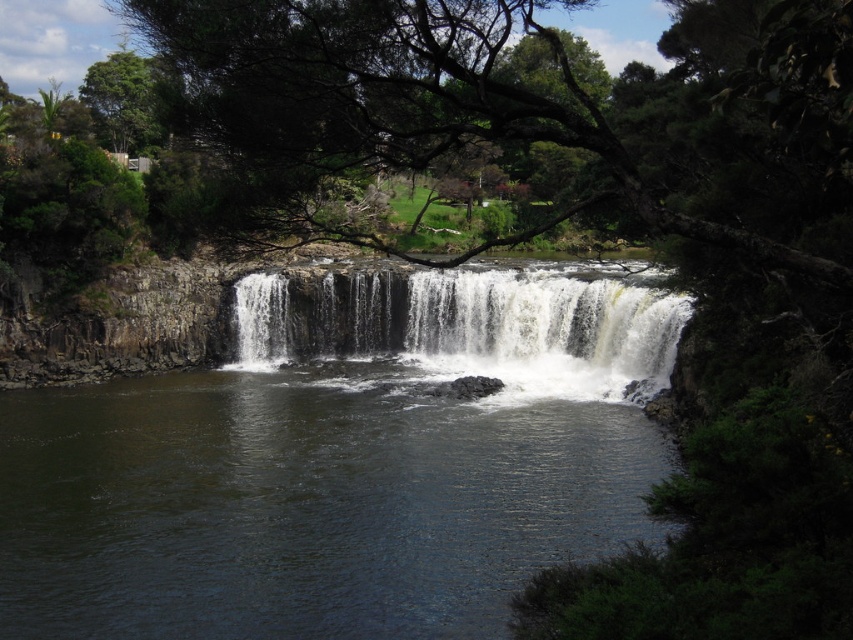
Question: Does dark green water at center have a greater width compared to white textured water at center?

Choices:
 (A) no
 (B) yes

Answer: (B)

Question: Is dark green water at center behind white textured water at center?

Choices:
 (A) no
 (B) yes

Answer: (A)

Question: Is dark green water at center positioned in front of white textured water at center?

Choices:
 (A) yes
 (B) no

Answer: (A)

Question: Among these points, which one is farthest from the camera?

Choices:
 (A) (521, 508)
 (B) (554, 392)

Answer: (B)